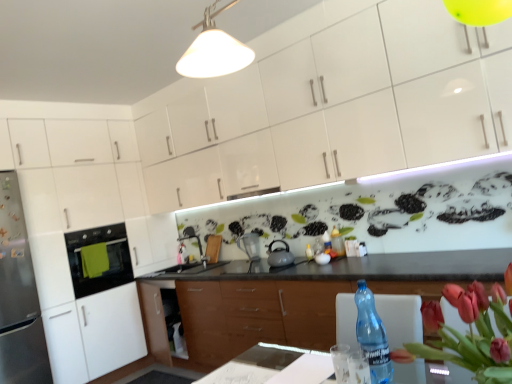
Question: From a real-world perspective, does matte silver pitcher at center sit lower than matte gray tea pot at center?

Choices:
 (A) yes
 (B) no

Answer: (B)

Question: Is matte gray tea pot at center inside matte silver pitcher at center?

Choices:
 (A) yes
 (B) no

Answer: (B)

Question: From the image's perspective, is matte silver pitcher at center below matte gray tea pot at center?

Choices:
 (A) yes
 (B) no

Answer: (A)

Question: Can you confirm if matte silver pitcher at center is smaller than matte gray tea pot at center?

Choices:
 (A) yes
 (B) no

Answer: (B)

Question: Is matte silver pitcher at center positioned beyond the bounds of matte gray tea pot at center?

Choices:
 (A) no
 (B) yes

Answer: (B)

Question: Considering their positions, is vivid red petals at right located in front of or behind wooden cabinet at center, which is counted as the 3th cabinetry, starting from the top?

Choices:
 (A) behind
 (B) front

Answer: (B)

Question: From a real-world perspective, relative to wooden cabinet at center, which is counted as the 3th cabinetry, starting from the top, is vivid red petals at right vertically above or below?

Choices:
 (A) below
 (B) above

Answer: (B)

Question: From their relative heights in the image, would you say vivid red petals at right is taller or shorter than wooden cabinet at center, which is counted as the 3th cabinetry, starting from the top?

Choices:
 (A) tall
 (B) short

Answer: (B)

Question: Is point (465, 352) positioned closer to the camera than point (273, 283)?

Choices:
 (A) farther
 (B) closer

Answer: (B)

Question: Considering the relative positions of matte gray tea pot at center and vivid red petals at right in the image provided, is matte gray tea pot at center to the left or to the right of vivid red petals at right?

Choices:
 (A) left
 (B) right

Answer: (A)

Question: Considering their positions, is matte gray tea pot at center located in front of or behind vivid red petals at right?

Choices:
 (A) front
 (B) behind

Answer: (B)

Question: Is matte gray tea pot at center taller or shorter than vivid red petals at right?

Choices:
 (A) tall
 (B) short

Answer: (B)

Question: Choose the correct answer: Is matte gray tea pot at center inside vivid red petals at right or outside it?

Choices:
 (A) outside
 (B) inside

Answer: (A)

Question: Would you say clear glass water at table center is to the left or to the right of transparent plastic bottle at lower right in the picture?

Choices:
 (A) left
 (B) right

Answer: (A)

Question: Considering the positions of clear glass water at table center and transparent plastic bottle at lower right in the image, is clear glass water at table center bigger or smaller than transparent plastic bottle at lower right?

Choices:
 (A) big
 (B) small

Answer: (B)